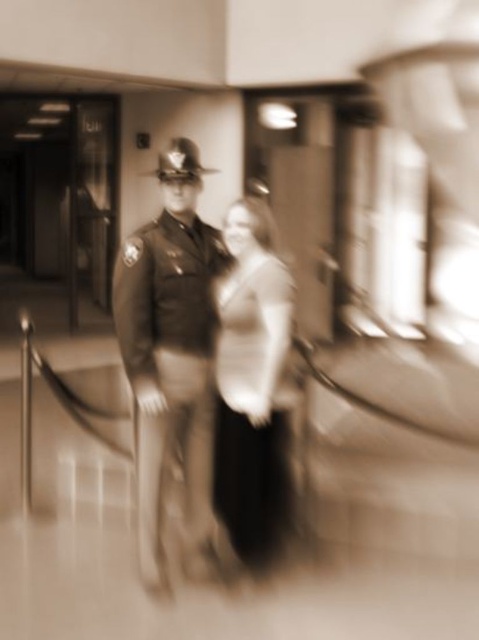
Question: Is uniformed officer at center positioned behind matte white blouse at center?

Choices:
 (A) no
 (B) yes

Answer: (A)

Question: Is uniformed officer at center above matte white blouse at center?

Choices:
 (A) no
 (B) yes

Answer: (B)

Question: Considering the relative positions of uniformed officer at center and matte white blouse at center in the image provided, where is uniformed officer at center located with respect to matte white blouse at center?

Choices:
 (A) left
 (B) right

Answer: (A)

Question: Among these objects, which one is farthest from the camera?

Choices:
 (A) uniformed officer at center
 (B) matte white blouse at center

Answer: (B)